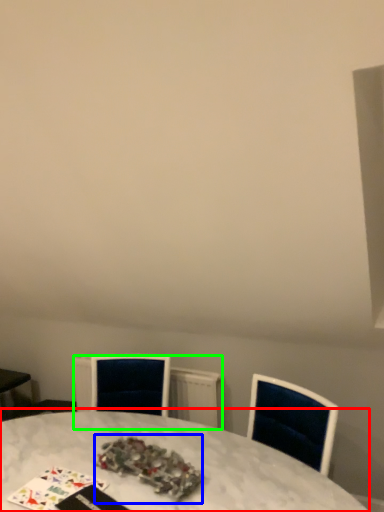
Question: Which object is positioned farthest from table (highlighted by a red box)? Select from christmas decoration (highlighted by a blue box) and radiator (highlighted by a green box).

Choices:
 (A) christmas decoration
 (B) radiator

Answer: (B)